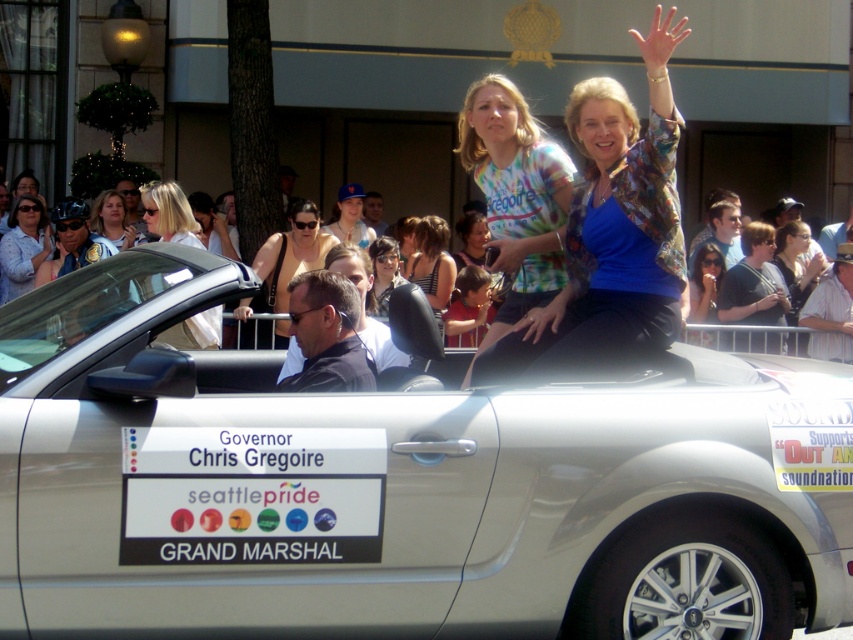
You are a photographer standing at the camera position. You want to take a photo of the silver metallic convertible at center from a distance that ensures the entire car fits in the frame. Your camera has a standard lens with a focal length of 50mm. According to the rule of thumb, the minimum distance required to capture a full car length of 4.6 meters with a 50mm lens is approximately 4.66 meters. Can you position yourself at the current camera position to achieve this?

The silver metallic convertible at center and camera are 4.66 meters apart from each other. Since the minimum required distance is approximately 4.66 meters to capture the full length of the car with a 50mm lens, positioning yourself at the current camera position will allow you to capture the entire car in the frame.